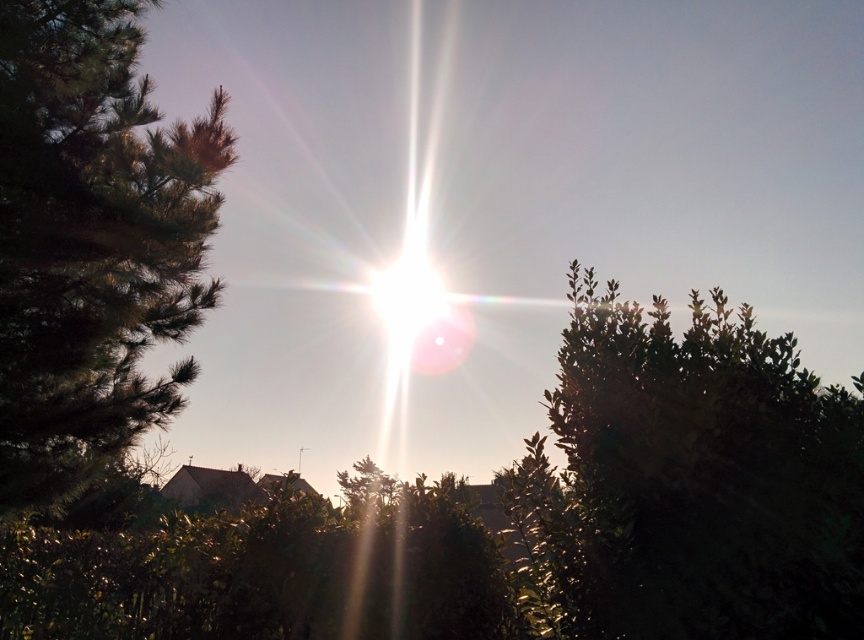
You are an astronomer trying to capture the sunset with a telescope. You notice the green leafy bush at upper right in your viewfinder. Based on its position, can you determine if it will block the sun in your photograph?

The green leafy bush at upper right is located at point (694, 481), which is close to the center where the sun is positioned. This means the bush may partially or fully block the sun in your photograph.

You are an outdoor photographer wanting to capture the sun in your shot. You notice the green leafy bush at upper right and the green leafy tree at left. Which object is shorter and might not block the sunlight as much?

The green leafy bush at upper right is not as tall as the green leafy tree at left, so it might not block the sunlight as much.

You are standing in the middle of the scene and want to place a 10 feet long bench between the green leafy bush at upper right and the green leafy tree at left. Will there be enough space for the bench?

The distance between the green leafy bush at upper right and the green leafy tree at left is 18.82 feet, which is greater than the bench length of 10 feet. Therefore, there is enough space to place the bench between them.